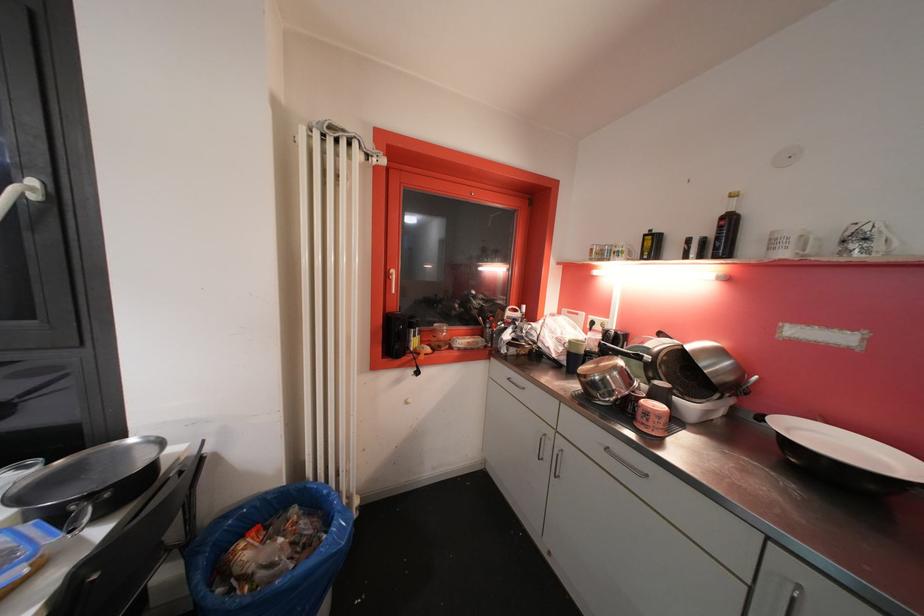
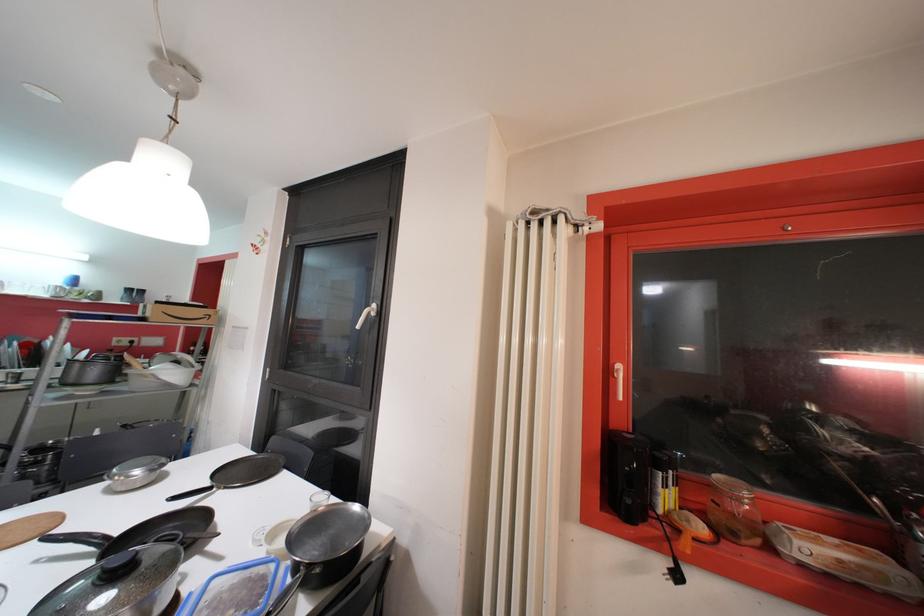
In the second image, find the point that corresponds to pixel 444 349 in the first image.

(738, 536)